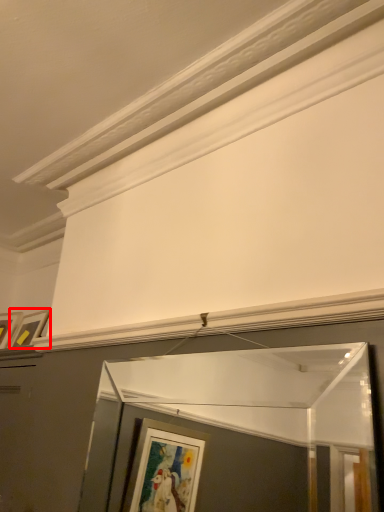
Question: From the image's perspective, what is the correct spatial relationship of picture frame (annotated by the red box) in relation to window frame?

Choices:
 (A) above
 (B) below

Answer: (A)